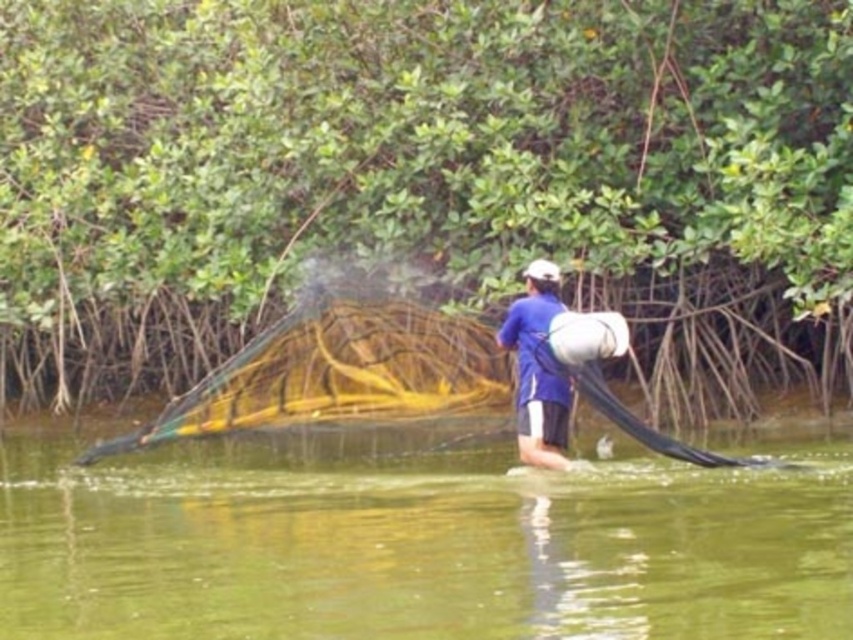
Question: Which object appears closest to the camera in this image?

Choices:
 (A) blue fabric shirt at center
 (B) green translucent water at center
 (C) green leafy mangrove at center

Answer: (B)

Question: Does green translucent water at center appear under blue fabric shirt at center?

Choices:
 (A) yes
 (B) no

Answer: (A)

Question: Is green leafy mangrove at center wider than blue fabric shirt at center?

Choices:
 (A) yes
 (B) no

Answer: (A)

Question: Does green leafy mangrove at center have a lesser width compared to green translucent water at center?

Choices:
 (A) yes
 (B) no

Answer: (B)

Question: Considering the real-world distances, which object is farthest from the green translucent water at center?

Choices:
 (A) green leafy mangrove at center
 (B) blue fabric shirt at center

Answer: (A)

Question: Which is nearer to the green leafy mangrove at center?

Choices:
 (A) blue fabric shirt at center
 (B) green translucent water at center

Answer: (B)